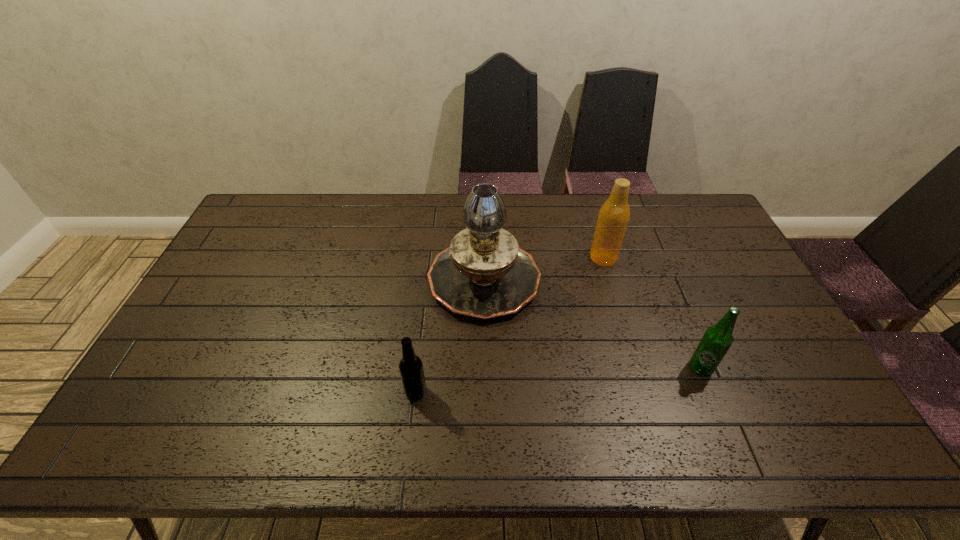
At what (x,y) coordinates should I click in order to perform the action: click on vacant area situated 0.090m on the right of the nearest object. Please return your answer as a coordinate pair (x, y). Looking at the image, I should click on (463, 392).

At what (x,y) coordinates should I click in order to perform the action: click on free spot at the far edge of the desktop. Please return your answer as a coordinate pair (x, y). Looking at the image, I should click on (643, 199).

Where is `vacant area at the left edge of the desktop`? vacant area at the left edge of the desktop is located at coordinates (237, 260).

The image size is (960, 540). In the image, there is a desktop. Identify the location of vacant space at the right edge. (747, 324).

Where is `vacant area at the far left corner of the desktop`? This screenshot has width=960, height=540. vacant area at the far left corner of the desktop is located at coordinates [x=262, y=210].

Where is `free space at the near left corner`? Image resolution: width=960 pixels, height=540 pixels. free space at the near left corner is located at coordinates (177, 447).

The image size is (960, 540). What are the coordinates of `vacant region at the far right corner` in the screenshot? It's located at (658, 195).

Where is `unoccupied area between the farthest beer bottle and the leftmost beer bottle`? This screenshot has width=960, height=540. unoccupied area between the farthest beer bottle and the leftmost beer bottle is located at coordinates (510, 325).

This screenshot has height=540, width=960. I want to click on free area in between the leftmost beer bottle and the rightmost beer bottle, so click(558, 380).

Image resolution: width=960 pixels, height=540 pixels. Find the location of `vacant point located between the tallest beer bottle and the oil lamp`. vacant point located between the tallest beer bottle and the oil lamp is located at coordinates (543, 267).